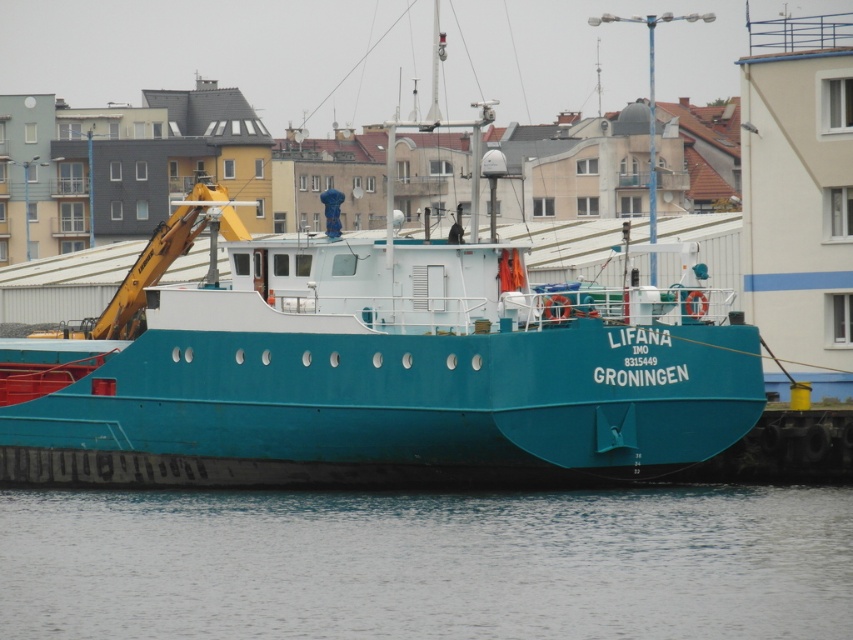
You are a port authority inspector assessing the docking conditions. The teal matte boat at center and transparent water at lower center are critical to your report. Based on their sizes, which object would require more space for maneuvering in the harbor?

The teal matte boat at center is much taller than the transparent water at lower center, so it would require more space for maneuvering in the harbor due to its larger size.

You are an observer standing on the dock looking at the teal matte boat at center and the transparent water at lower center. Which object is closer to you?

The teal matte boat at center is closer to you because the transparent water at lower center is behind it.

You are a marine biologist observing the ship from a nearby pier. You notice the teal matte boat at center and the transparent water at lower center. Which object is positioned higher in the scene?

The teal matte boat at center is positioned higher than the transparent water at lower center, as it is located above it.